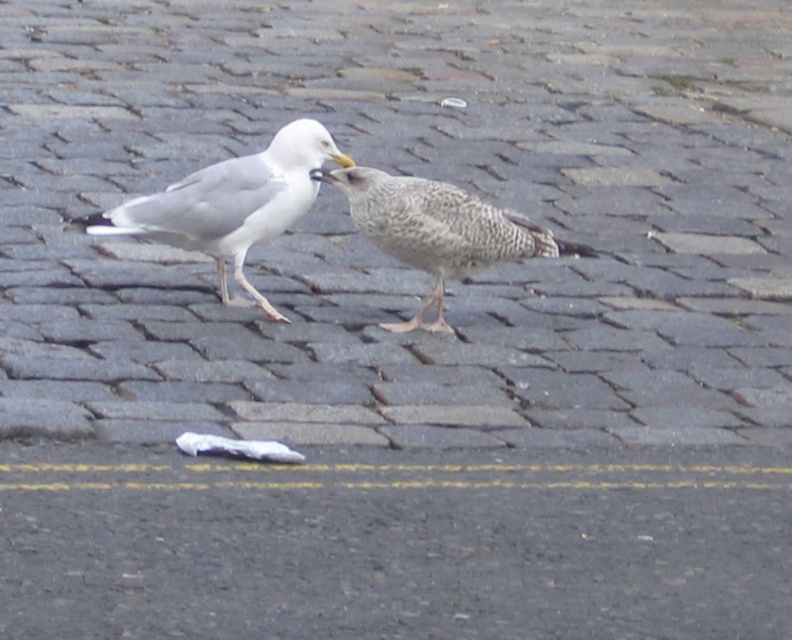
You are standing in a park and see the white matte seagull at center and the speckled feathered bird at center. Which one is nearer to you?

The white matte seagull at center is closer to the viewer than the speckled feathered bird at center, so the white matte seagull at center is nearer to you.

You are a birdwatcher observing two birds on a cobblestone surface. You see the white matte seagull at center and the speckled feathered bird at center. Which one has a larger body size?

The white matte seagull at center is bigger than the speckled feathered bird at center.